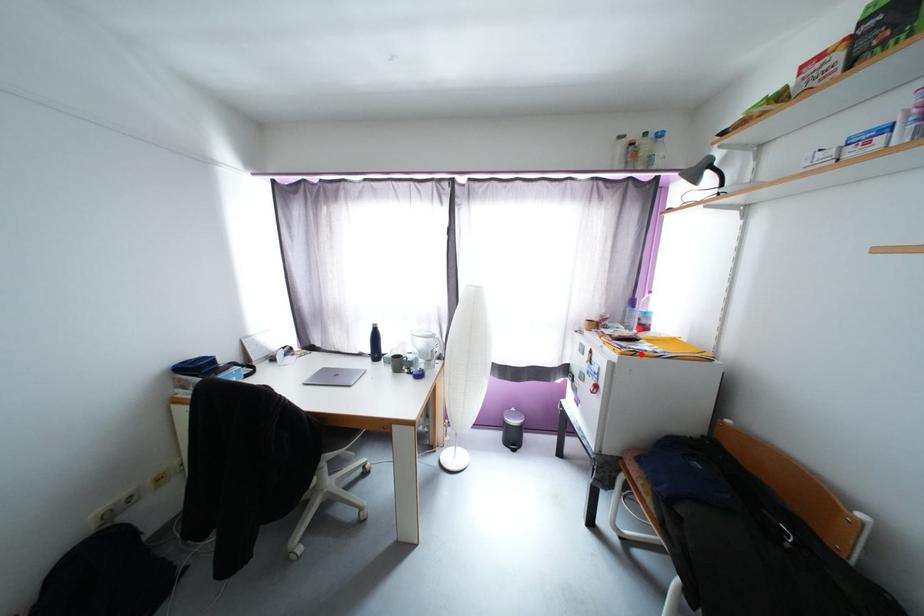
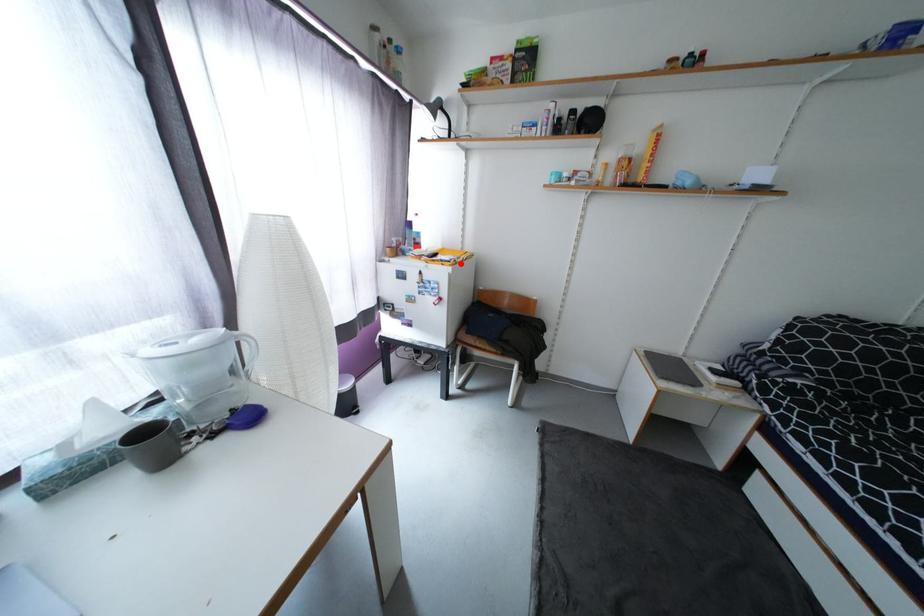
I am providing you with two images of the same scene from different viewpoints. A red point is marked on the first image and another point is marked on the second image. Is the marked point in image1 the same physical position as the marked point in image2?

Yes